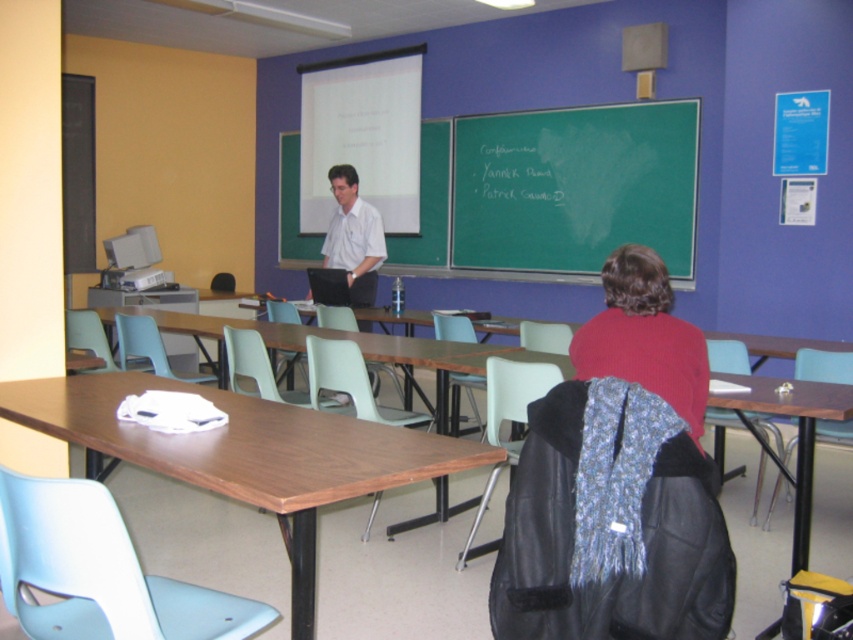
You are a student sitting in the classroom and you need to locate the green chalkboard at center and the white shirt at center. From your perspective, which object is positioned to the right?

The green chalkboard at center is to the right of the white shirt at center.

You are a student sitting at the back of the classroom. You need to write something on the green chalkboard at center. Can you reach it from your current position?

The green chalkboard at center is located at point (556, 189), which is within the classroom. Since you are sitting at the back, you can physically reach the chalkboard by walking to the front. However, the exact reachability might depend on the classroom layout and your ability to move freely. Assuming typical classroom arrangements, yes, you can reach it.

You are a student sitting in the classroom and you need to hang a poster on the wall behind the green chalkboard at center and the red knit sweater at center. Which object allows you to hang the poster higher?

The green chalkboard at center is much taller than the red knit sweater at center, so you can hang the poster higher behind the green chalkboard at center.